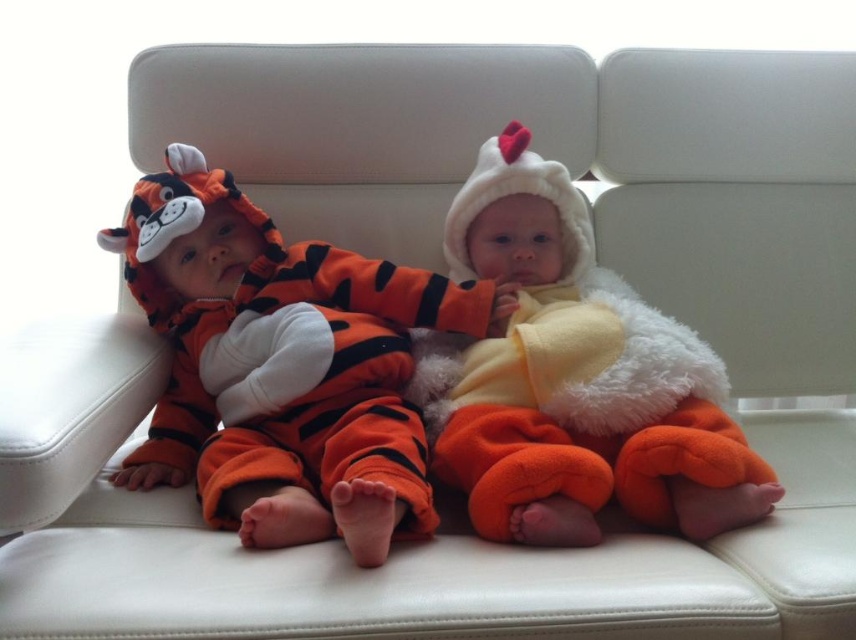
You are a photographer trying to capture a closeup of the orange fuzzy tiger suit at left. What coordinates should you focus on to ensure the tiger suit is centered in your shot?

You should focus on the coordinates point (283, 365) to center the orange fuzzy tiger suit at left in your shot.

You are a photographer setting up a shoot in the living room. You need to position a light source to the left of the orange fuzzy tiger suit at left and to the right of the fluffy orange chicken at center. Is this possible given their positions?

The orange fuzzy tiger suit at left is in front of the fluffy orange chicken at center, so placing a light source to the left of the tiger suit and to the right of the chicken is possible because the tiger suit is closer to the photographer than the chicken.

Consider the image. You are a photographer setting up a shoot for the two babies in the image. You need to adjust the camera height so that both the orange fuzzy tiger suit at left and the fluffy orange chicken at center are in focus. Which baby should you position closer to the camera to ensure both are in focus?

The orange fuzzy tiger suit at left is not as tall as the fluffy orange chicken at center. To ensure both are in focus, position the orange fuzzy tiger suit at left closer to the camera since it is shorter than the fluffy orange chicken at center.